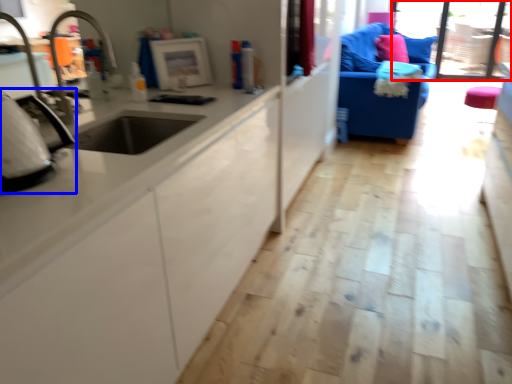
Question: Which object appears farthest to the camera in this image, window screen (highlighted by a red box) or appliance (highlighted by a blue box)?

Choices:
 (A) window screen
 (B) appliance

Answer: (A)